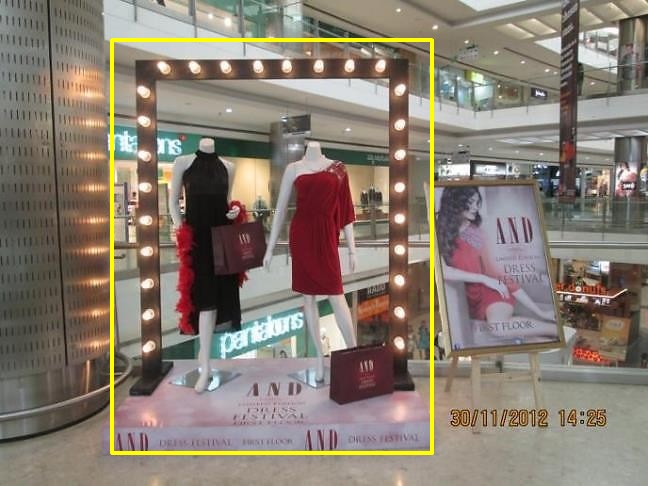
Where is `floor`? The image size is (648, 486). floor is located at coordinates point(529,115), point(568,248), point(369,268), point(356,100), point(334,132), point(459,469).